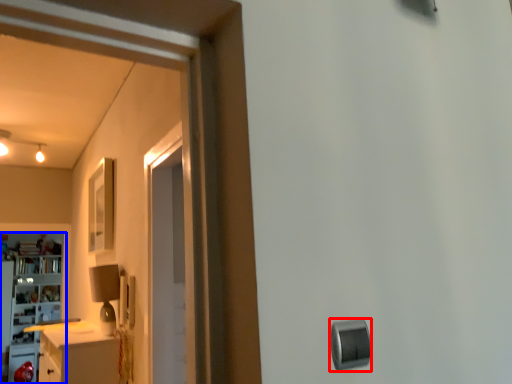
Question: Which of the following is the closest to the observer, knob (highlighted by a red box) or cabinetry (highlighted by a blue box)?

Choices:
 (A) knob
 (B) cabinetry

Answer: (A)